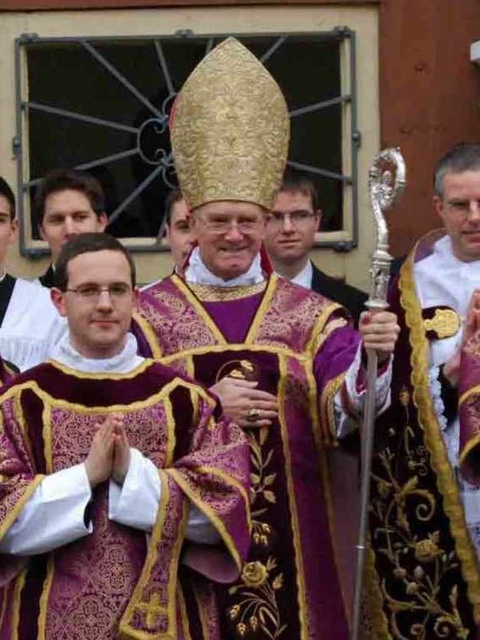
Question: Can you confirm if purple brocade robe at center is positioned to the right of velvet gold robe at center?

Choices:
 (A) no
 (B) yes

Answer: (A)

Question: Which of the following is the farthest from the observer?

Choices:
 (A) coord(445,355)
 (B) coord(284,392)
 (C) coord(24,472)
 (D) coord(304,260)

Answer: (D)

Question: Considering the relative positions of purple embroidered robe at center and velvet gold robe at center in the image provided, where is purple embroidered robe at center located with respect to velvet gold robe at center?

Choices:
 (A) above
 (B) below

Answer: (B)

Question: Is purple brocade robe at center bigger than velvet gold robe at center?

Choices:
 (A) yes
 (B) no

Answer: (A)

Question: Considering the real-world distances, which object is closest to the purple embroidered robe at center?

Choices:
 (A) velvet gold robe at center
 (B) purple brocade robe at center
 (C) purple satin robe at center

Answer: (B)

Question: Which point is closer to the camera taking this photo?

Choices:
 (A) (315, 273)
 (B) (248, 536)
 (C) (325, 516)
 (D) (463, 548)

Answer: (B)